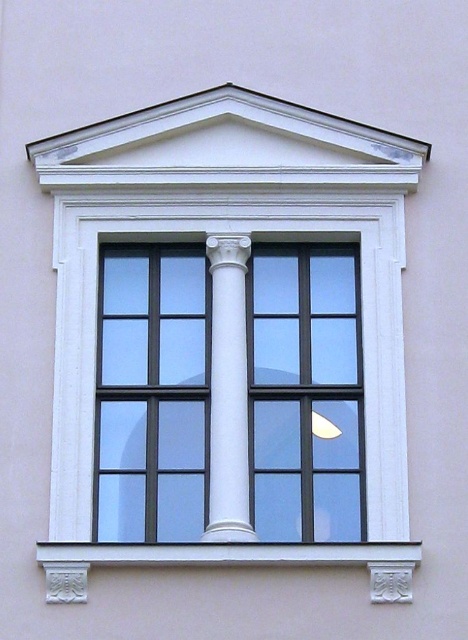
Question: Is clear glass window at center above white stone window sill at lower center?

Choices:
 (A) yes
 (B) no

Answer: (A)

Question: Among these points, which one is nearest to the camera?

Choices:
 (A) (241, 396)
 (B) (238, 465)
 (C) (248, 248)
 (D) (121, 557)

Answer: (D)

Question: Among these points, which one is nearest to the camera?

Choices:
 (A) (239, 276)
 (B) (107, 172)

Answer: (A)

Question: Can you confirm if white stone window sill at lower center is wider than white glossy column at center?

Choices:
 (A) yes
 (B) no

Answer: (A)

Question: From the image, what is the correct spatial relationship of white glossy window frame at upper center in relation to white stone window sill at lower center?

Choices:
 (A) right
 (B) left

Answer: (B)

Question: Which of these objects is positioned farthest from the white stone window sill at lower center?

Choices:
 (A) clear glass window at center
 (B) white glossy window frame at upper center
 (C) white glossy column at center

Answer: (B)